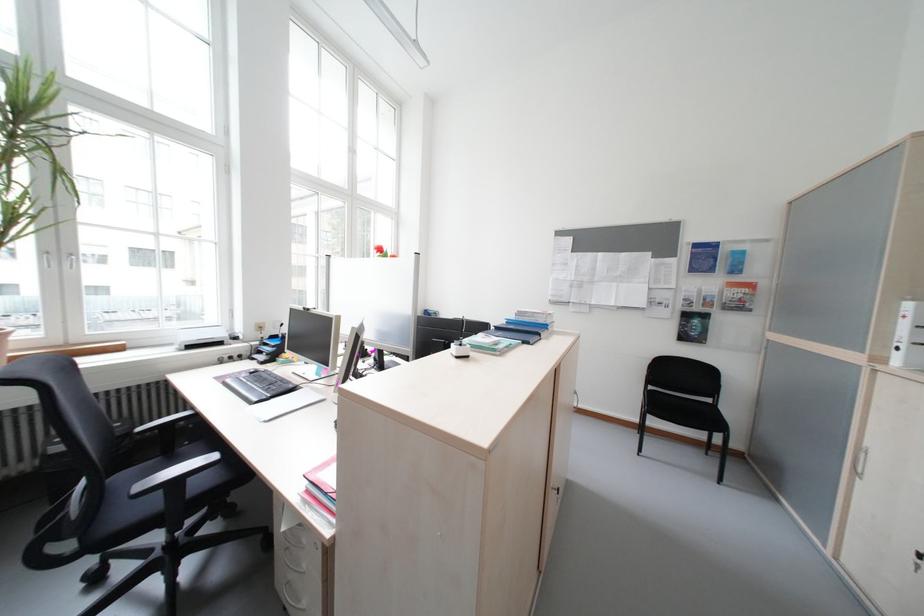
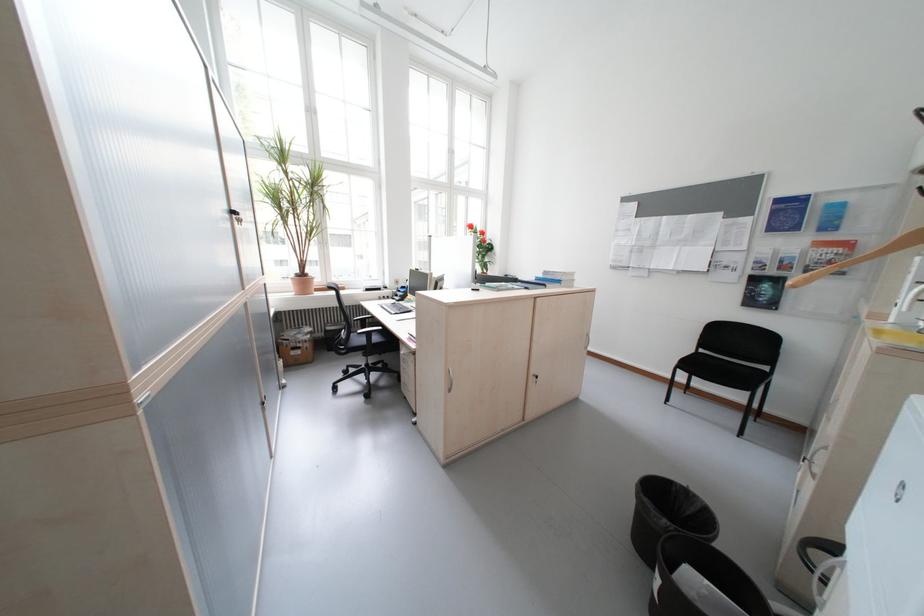
Locate, in the second image, the point that corresponds to the point at 186,484 in the first image.

(380, 334)